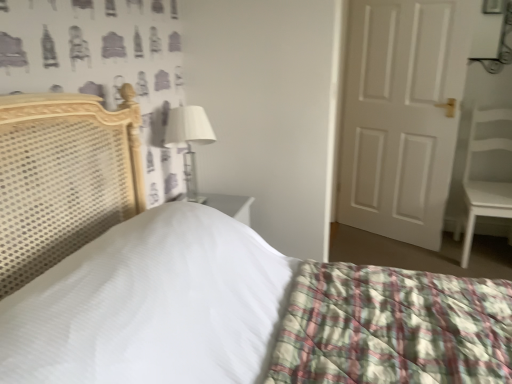
Question: Is white fabric-covered lampshade at upper center positioned with its back to white matte chair at right?

Choices:
 (A) yes
 (B) no

Answer: (B)

Question: Would you say white fabric-covered lampshade at upper center contains white matte chair at right?

Choices:
 (A) no
 (B) yes

Answer: (A)

Question: Is white fabric-covered lampshade at upper center closer to the viewer compared to white matte chair at right?

Choices:
 (A) no
 (B) yes

Answer: (B)

Question: From the image's perspective, does white fabric-covered lampshade at upper center appear lower than white matte chair at right?

Choices:
 (A) no
 (B) yes

Answer: (A)

Question: Does white fabric-covered lampshade at upper center have a smaller size compared to white matte chair at right?

Choices:
 (A) yes
 (B) no

Answer: (A)

Question: Considering the relative sizes of white fabric-covered lampshade at upper center and white matte chair at right in the image provided, is white fabric-covered lampshade at upper center thinner than white matte chair at right?

Choices:
 (A) yes
 (B) no

Answer: (A)

Question: Is the depth of white matte chair at right less than that of white matte door at right?

Choices:
 (A) yes
 (B) no

Answer: (A)

Question: Is white matte chair at right far from white matte door at right?

Choices:
 (A) no
 (B) yes

Answer: (A)

Question: Considering the relative sizes of white matte chair at right and white matte door at right in the image provided, is white matte chair at right taller than white matte door at right?

Choices:
 (A) yes
 (B) no

Answer: (B)

Question: Is white matte chair at right positioned with its back to white matte door at right?

Choices:
 (A) yes
 (B) no

Answer: (B)

Question: Is white matte chair at right at the left side of white matte door at right?

Choices:
 (A) yes
 (B) no

Answer: (B)

Question: From a real-world perspective, does white matte chair at right stand above white matte door at right?

Choices:
 (A) no
 (B) yes

Answer: (A)

Question: Considering the relative sizes of white matte door at right and white fabric-covered lampshade at upper center in the image provided, is white matte door at right bigger than white fabric-covered lampshade at upper center?

Choices:
 (A) yes
 (B) no

Answer: (A)